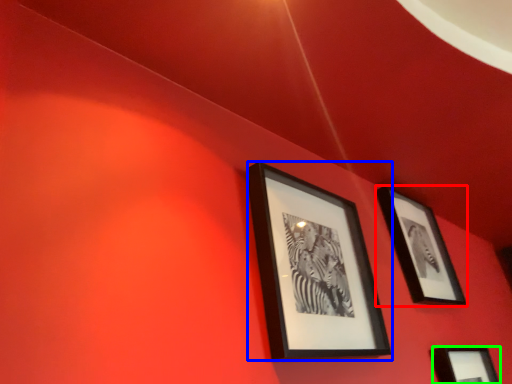
Question: Which is nearer to the picture frame (highlighted by a red box)? picture frame (highlighted by a blue box) or picture frame (highlighted by a green box).

Choices:
 (A) picture frame
 (B) picture frame

Answer: (B)